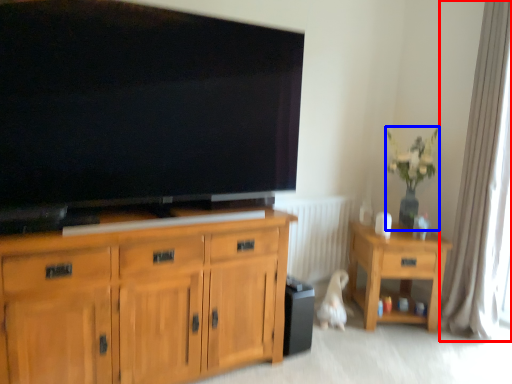
Question: Which object appears closest to the camera in this image, curtain (highlighted by a red box) or houseplant (highlighted by a blue box)?

Choices:
 (A) curtain
 (B) houseplant

Answer: (A)